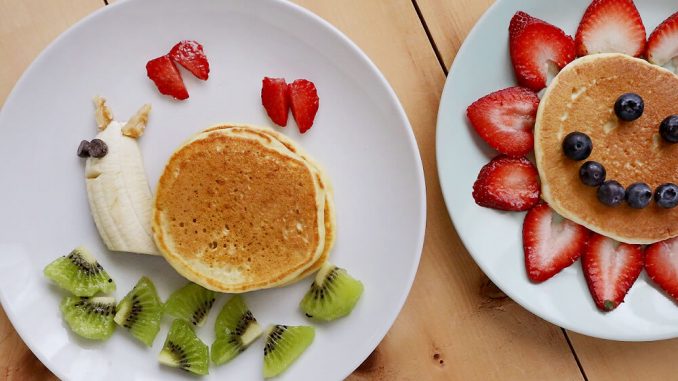
Where is `plates`? Image resolution: width=678 pixels, height=381 pixels. plates is located at coordinates (492, 257), (407, 236).